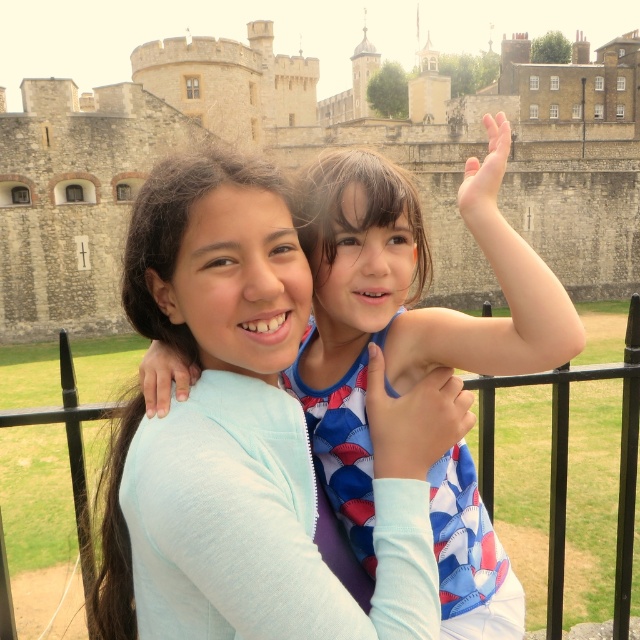
You are a photographer trying to capture a photo of the stone castle at center and the light blue fabric shirt at center. Which object should you focus on first if you want to ensure both are in focus?

The stone castle at center is positioned over light blue fabric shirt at center, so you should focus on the stone castle at center first to ensure both are in focus.

You are a photographer trying to capture a photo of the stone castle at center and the light blue fabric shirt at center. Based on their sizes, which one should you focus on to ensure it fills the frame better?

The stone castle at center is larger than the light blue fabric shirt at center, so focusing on the stone castle at center will fill the frame better.

You are a photographer trying to capture both the stone castle at center and the light blue fabric shirt at center in the same frame. Based on their positions, which object should you adjust your camera to focus on first to ensure both are in the frame?

The stone castle at center is to the left of the light blue fabric shirt at center, so you should focus on the stone castle at center first to ensure both are included in the frame.